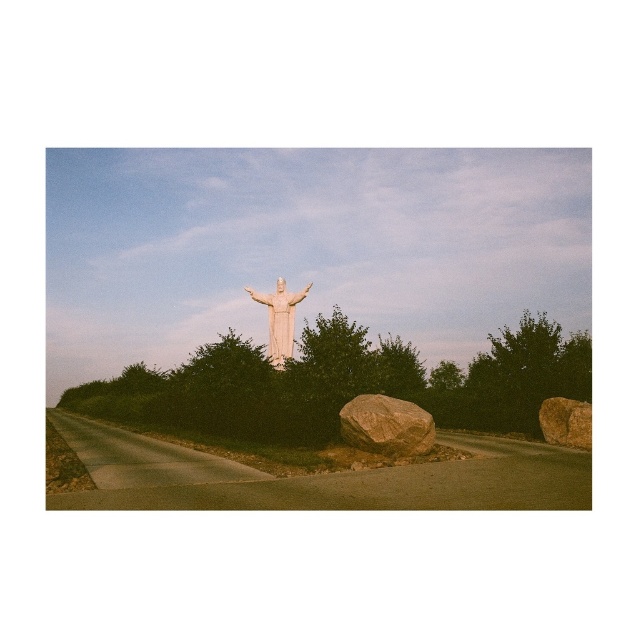
Question: Where is brown rough rock at right located in relation to white marble statue at center in the image?

Choices:
 (A) right
 (B) left

Answer: (A)

Question: Which of the following is the closest to the observer?

Choices:
 (A) (371, 397)
 (B) (282, 332)
 (C) (569, 432)

Answer: (A)

Question: Which of the following is the closest to the observer?

Choices:
 (A) (291, 314)
 (B) (356, 417)
 (C) (555, 412)

Answer: (B)

Question: Is brown rough rock at lower center positioned in front of brown rough rock at right?

Choices:
 (A) yes
 (B) no

Answer: (A)

Question: Which point is closer to the camera taking this photo?

Choices:
 (A) (424, 410)
 (B) (266, 305)

Answer: (A)

Question: Is brown rough rock at lower center to the right of white marble statue at center from the viewer's perspective?

Choices:
 (A) no
 (B) yes

Answer: (B)